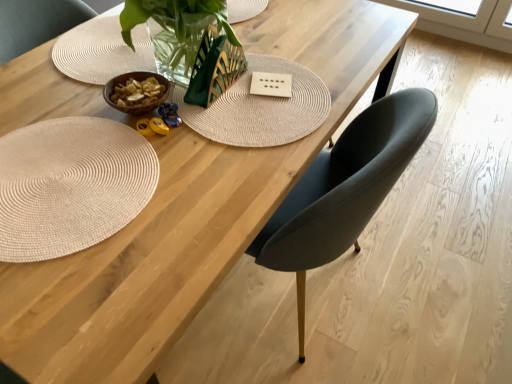
Identify the location of white matte card at center. (271, 84).

The width and height of the screenshot is (512, 384). Describe the element at coordinates (271, 84) in the screenshot. I see `white matte card at center` at that location.

Describe the element at coordinates (70, 185) in the screenshot. Image resolution: width=512 pixels, height=384 pixels. I see `natural woven mat at lower left` at that location.

Where is `natural woven mat at lower left`? The image size is (512, 384). natural woven mat at lower left is located at coordinates (70, 185).

Find the location of a particular element. Image resolution: width=512 pixels, height=384 pixels. white matte card at center is located at coordinates (271, 84).

In the scene shown: Visually, is white matte card at center positioned to the left or to the right of natural woven mat at lower left?

white matte card at center is positioned on natural woven mat at lower left's right side.

Consider the image. Which object is more forward, white matte card at center or natural woven mat at lower left?

natural woven mat at lower left is more forward.

Is point (258, 78) less distant than point (83, 186)?

No, (258, 78) is further to viewer.

From the image's perspective, who appears lower, white matte card at center or natural woven mat at lower left?

From the image's view, natural woven mat at lower left is below.

From a real-world perspective, relative to natural woven mat at lower left, is white matte card at center vertically above or below?

In terms of real-world spatial position, white matte card at center is below natural woven mat at lower left.

Between white matte card at center and natural woven mat at lower left, which one has smaller width?

With smaller width is white matte card at center.

Looking at this image, considering the sizes of white matte card at center and natural woven mat at lower left in the image, is white matte card at center taller or shorter than natural woven mat at lower left?

white matte card at center is shorter than natural woven mat at lower left.

Considering the relative sizes of white matte card at center and natural woven mat at lower left in the image provided, is white matte card at center bigger than natural woven mat at lower left?

Actually, white matte card at center might be smaller than natural woven mat at lower left.

Is white matte card at center surrounding natural woven mat at lower left?

Actually, natural woven mat at lower left is outside white matte card at center.

Is white matte card at center next to natural woven mat at lower left and touching it?

There is a gap between white matte card at center and natural woven mat at lower left.

Is white matte card at center aimed at natural woven mat at lower left?

No, white matte card at center is not facing towards natural woven mat at lower left.

What's the angular difference between white matte card at center and natural woven mat at lower left's facing directions?

They differ by 116 degrees in their facing directions.

You are a GUI agent. You are given a task and a screenshot of the screen. Output one action in this format:
    pyautogui.click(x=<x>, y=<y>)
    Task: Click on the card on the right of natural woven mat at lower left
    
    Given the screenshot: What is the action you would take?
    pyautogui.click(x=271, y=84)

Looking at this image, is natural woven mat at lower left to the right of white matte card at center from the viewer's perspective?

In fact, natural woven mat at lower left is to the left of white matte card at center.

Between natural woven mat at lower left and white matte card at center, which one is positioned in front?

natural woven mat at lower left is more forward.

Which point is more forward, (1, 162) or (268, 76)?

Positioned in front is point (1, 162).

From the image's perspective, would you say natural woven mat at lower left is shown under white matte card at center?

Yes, from the image's perspective, natural woven mat at lower left is beneath white matte card at center.

From a real-world perspective, which object stands above the other?

natural woven mat at lower left, from a real-world perspective.

Consider the image. Between natural woven mat at lower left and white matte card at center, which one has larger width?

natural woven mat at lower left is wider.

Between natural woven mat at lower left and white matte card at center, which one has more height?

Standing taller between the two is natural woven mat at lower left.

Is natural woven mat at lower left smaller than white matte card at center?

No.

From the picture: Is natural woven mat at lower left not within white matte card at center?

Indeed, natural woven mat at lower left is completely outside white matte card at center.

Would you consider natural woven mat at lower left to be distant from white matte card at center?

That's not correct — natural woven mat at lower left is a little close to white matte card at center.

Is natural woven mat at lower left oriented towards white matte card at center?

No, natural woven mat at lower left is not facing towards white matte card at center.

What's the angular difference between natural woven mat at lower left and white matte card at center's facing directions?

116 degrees separate the facing orientations of natural woven mat at lower left and white matte card at center.

Where is `mat on the left of white matte card at center`? This screenshot has height=384, width=512. mat on the left of white matte card at center is located at coordinates (70, 185).

Locate an element on the screen. This screenshot has height=384, width=512. card above the natural woven mat at lower left (from the image's perspective) is located at coordinates (271, 84).

In order to click on mat that is on the left side of white matte card at center in this screenshot , I will do `click(70, 185)`.